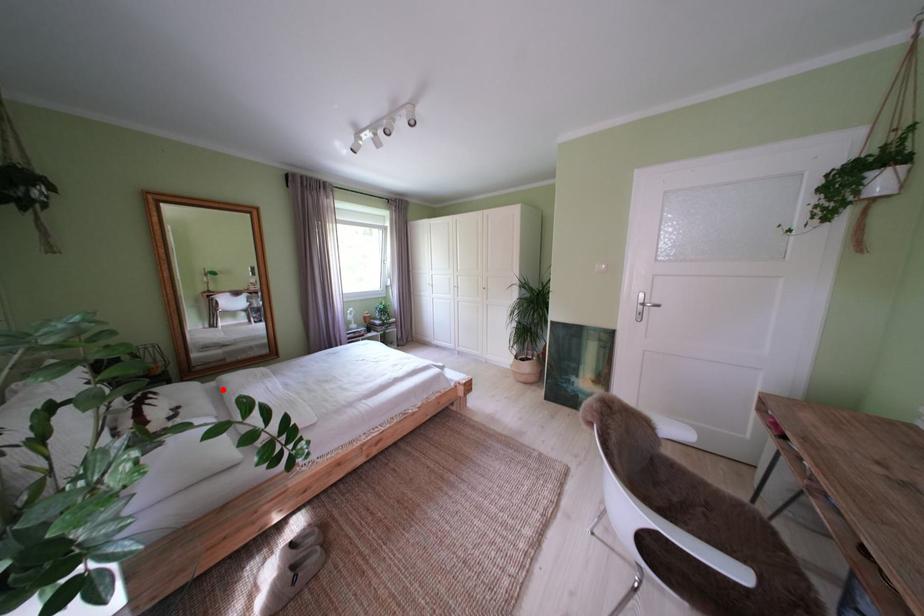
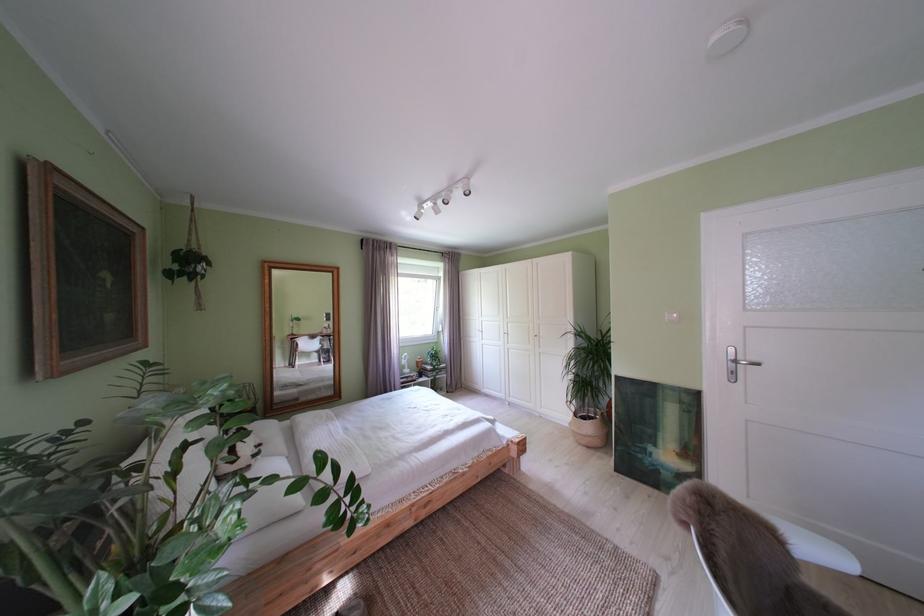
The point at the highlighted location is marked in the first image. Where is the corresponding point in the second image?

(298, 429)